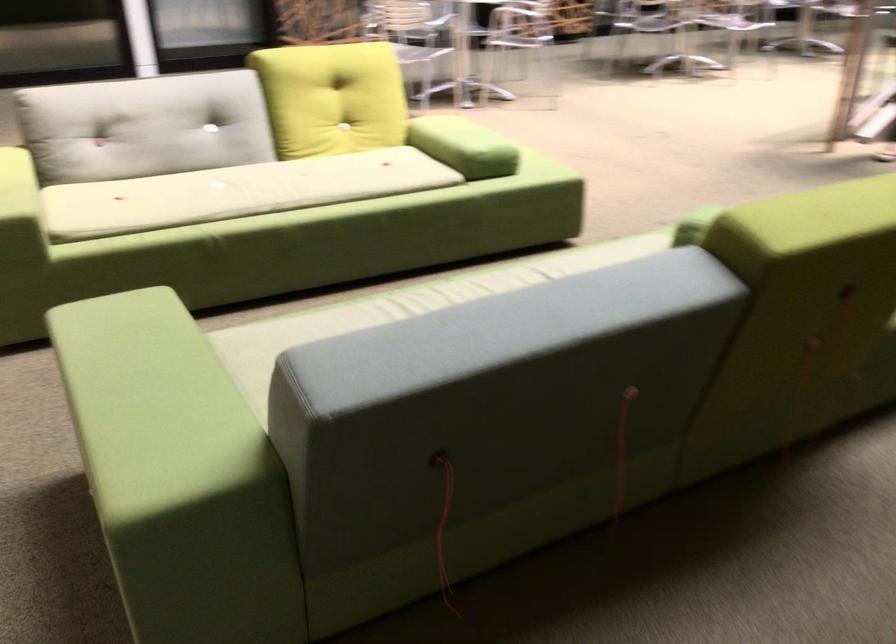
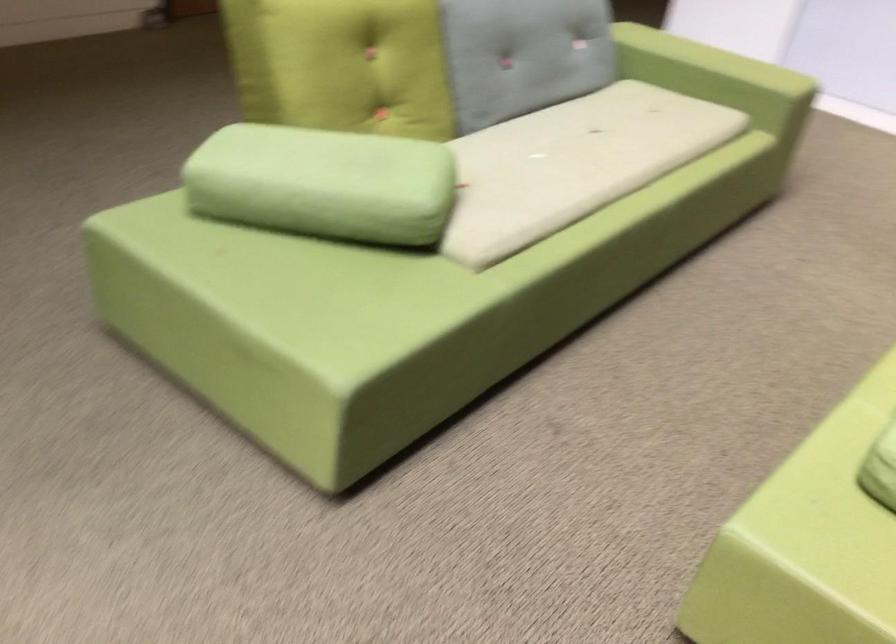
In the second image, find the point that corresponds to the point at 531,277 in the first image.

(572, 164)